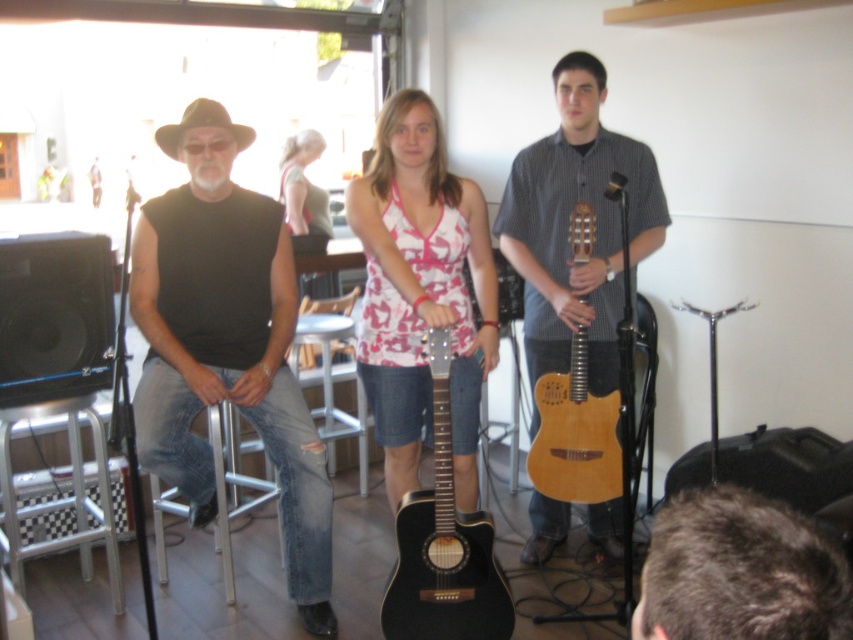
Is black acoustic guitar at center in front of metallic silver bar stool at center?

Yes, black acoustic guitar at center is in front of metallic silver bar stool at center.

Does black acoustic guitar at center appear on the right side of metallic silver bar stool at center?

Yes, black acoustic guitar at center is to the right of metallic silver bar stool at center.

Where is `black acoustic guitar at center`? black acoustic guitar at center is located at coordinates 444,545.

The image size is (853, 640). Describe the element at coordinates (421, 291) in the screenshot. I see `matte pink halter top at center` at that location.

Between matte pink halter top at center and matte pink guitar at center, which one has less height?

matte pink guitar at center

Who is more distant from viewer, (397, 109) or (415, 308)?

Point (397, 109)

Locate an element on the screen. This screenshot has width=853, height=640. matte pink halter top at center is located at coordinates (421, 291).

Does black acoustic guitar at center appear on the right side of acoustic guitar at center?

No, black acoustic guitar at center is not to the right of acoustic guitar at center.

Can you confirm if black acoustic guitar at center is smaller than acoustic guitar at center?

Actually, black acoustic guitar at center might be larger than acoustic guitar at center.

Is point (430, 625) positioned in front of point (610, 260)?

That is True.

Image resolution: width=853 pixels, height=640 pixels. In order to click on black acoustic guitar at center in this screenshot , I will do `click(444, 545)`.